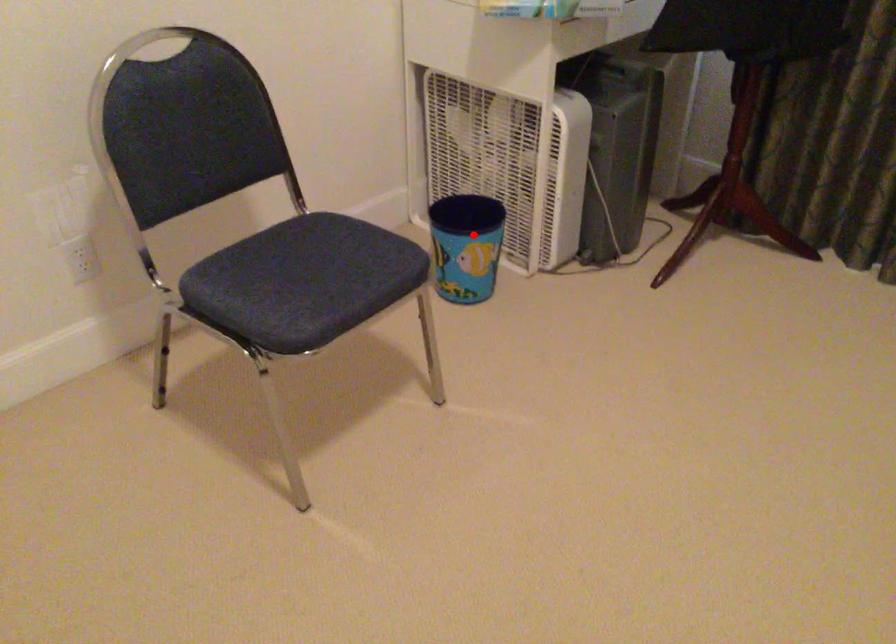
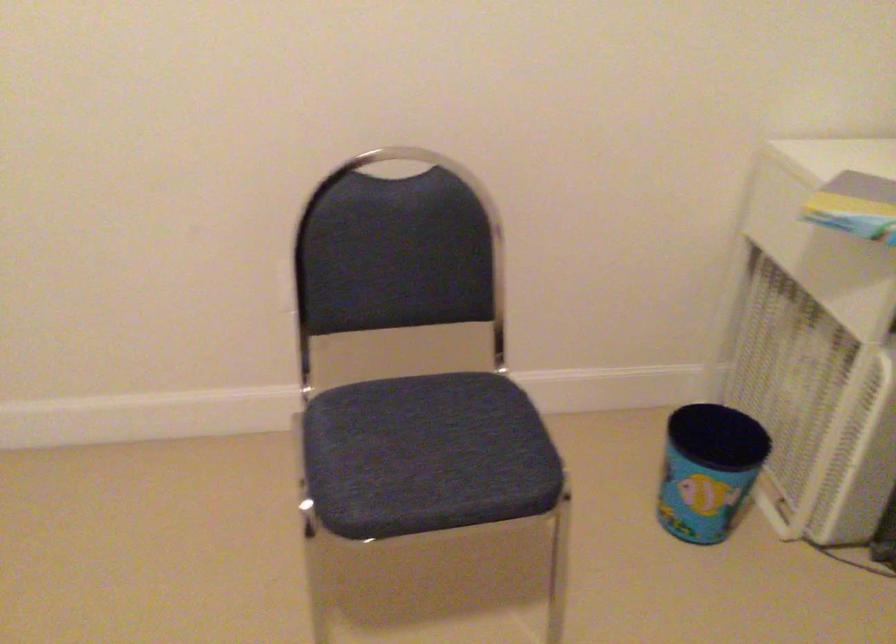
Where in the second image is the point corresponding to the highlighted location from the first image?

(708, 469)